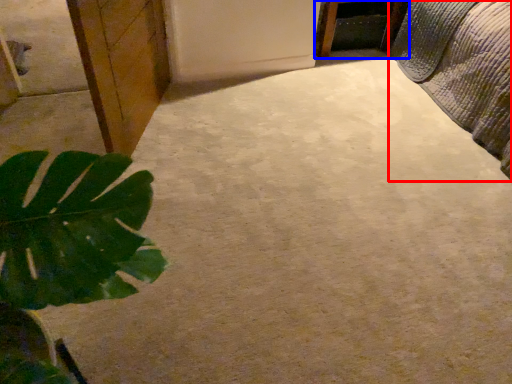
Question: Which object appears closest to the camera in this image, bed (highlighted by a red box) or furniture (highlighted by a blue box)?

Choices:
 (A) bed
 (B) furniture

Answer: (A)